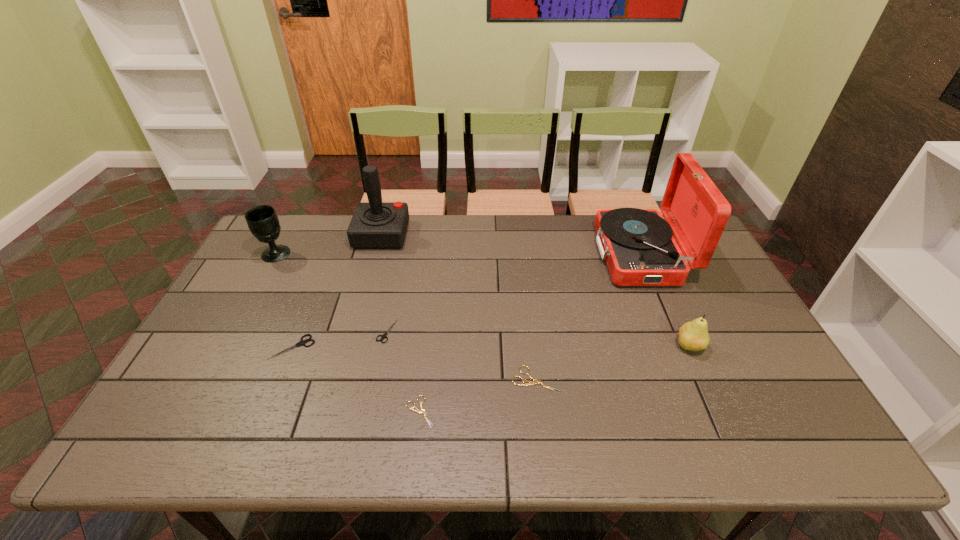
Locate an element on the screen. This screenshot has height=540, width=960. the smaller black shears is located at coordinates (384, 335).

Image resolution: width=960 pixels, height=540 pixels. Find the location of `the left beige shears`. the left beige shears is located at coordinates (417, 410).

Locate an element on the screen. The height and width of the screenshot is (540, 960). the third shears from left to right is located at coordinates (417, 410).

The width and height of the screenshot is (960, 540). Find the location of `vacant area situated on the front-facing side of the phonograph_record`. vacant area situated on the front-facing side of the phonograph_record is located at coordinates (477, 255).

In order to click on free region located 0.240m on the front-facing side of the phonograph_record in this screenshot , I will do `click(525, 255)`.

Identify the location of vacant space located on the front-facing side of the phonograph_record. The height and width of the screenshot is (540, 960). (490, 255).

Where is `free location located on the base of the joystick`? free location located on the base of the joystick is located at coordinates (510, 235).

Locate an element on the screen. This screenshot has width=960, height=540. vacant space located 0.140m on the front of the chalice is located at coordinates (254, 294).

You are a GUI agent. You are given a task and a screenshot of the screen. Output one action in this format:
    pyautogui.click(x=<x>, y=<y>)
    Task: Click on the free space located 0.110m on the back of the pear
    The height and width of the screenshot is (540, 960).
    Given the screenshot: What is the action you would take?
    pyautogui.click(x=672, y=307)

What are the coordinates of `free space located 0.080m on the right of the tallest shears` in the screenshot? It's located at (344, 347).